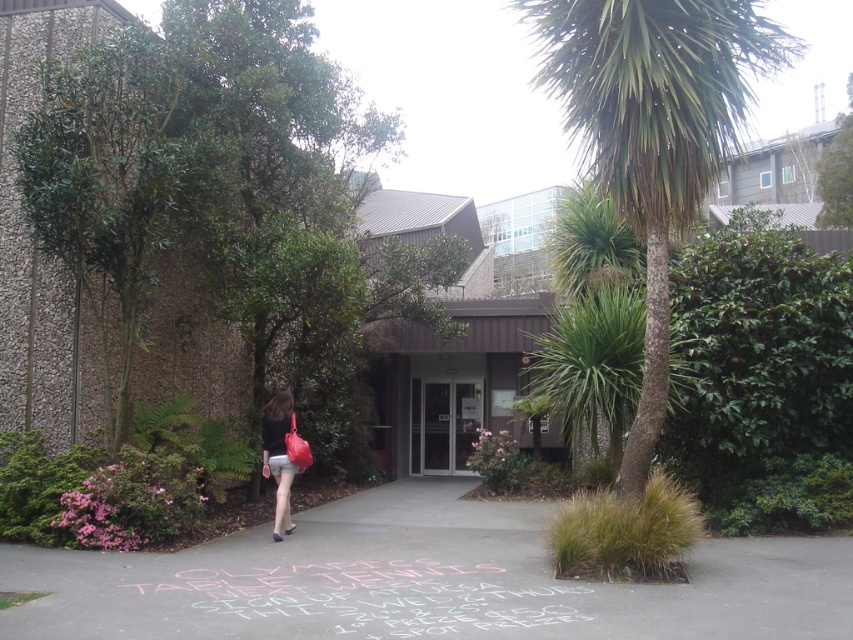
You are a delivery person standing at the entrance of the building. You need to place a package on the ground between the green leafy palm tree at upper right and the matte pink short at center. Is there enough space to place the package?

The distance between the green leafy palm tree at upper right and the matte pink short at center is 4.88 meters, so there is sufficient space to place the package between them.

You are standing at the entrance of the modern building and want to take a photo of the green leafy tree at left. Which direction should you face to capture it in your camera view?

The green leafy tree at left is located at point [219,189], which is to the left side of the scene. Therefore, you should face towards the left direction to capture it in your camera view.